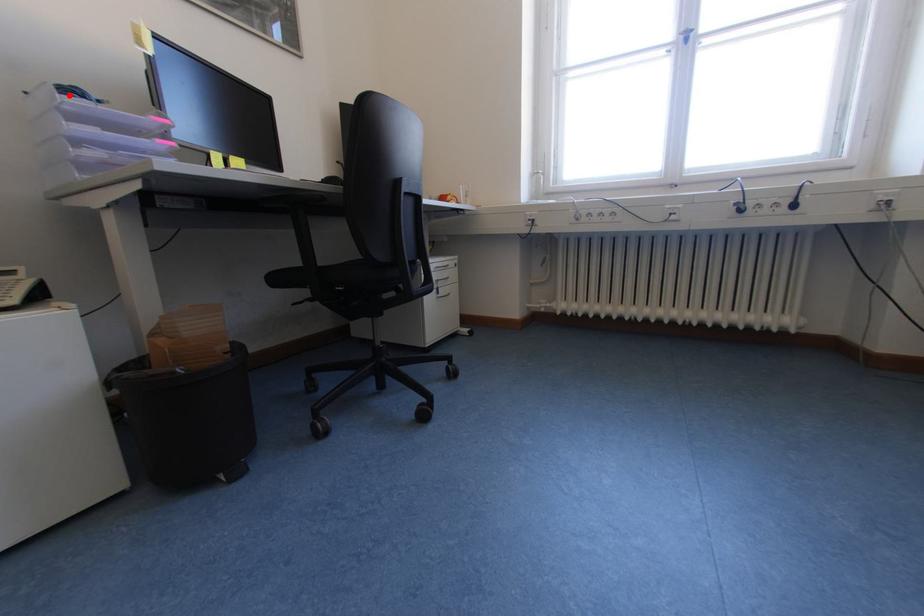
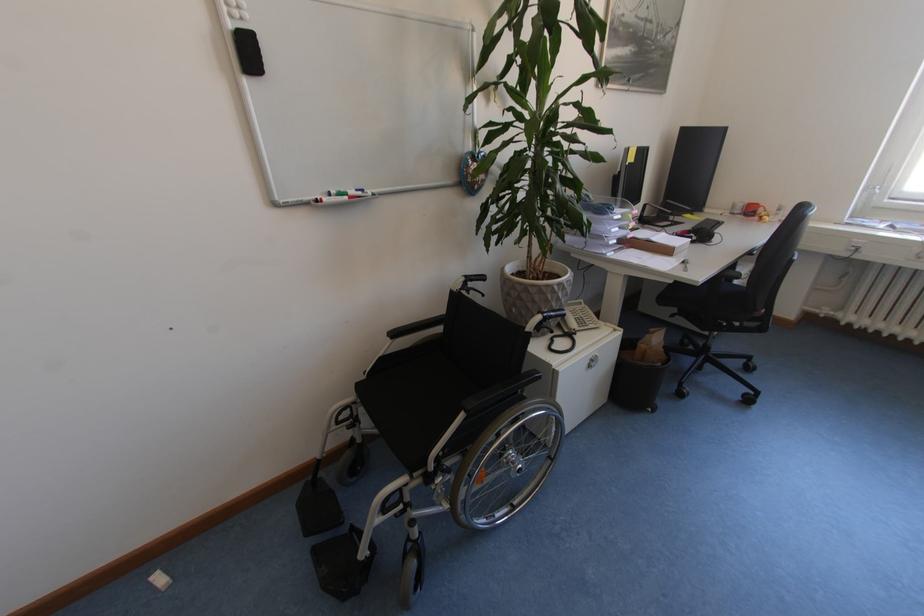
Question: I am providing you with two images of the same scene from different viewpoints. A red point is marked on the first image. Is the red point's position out of view in image 2?

Choices:
 (A) Yes
 (B) No

Answer: (A)